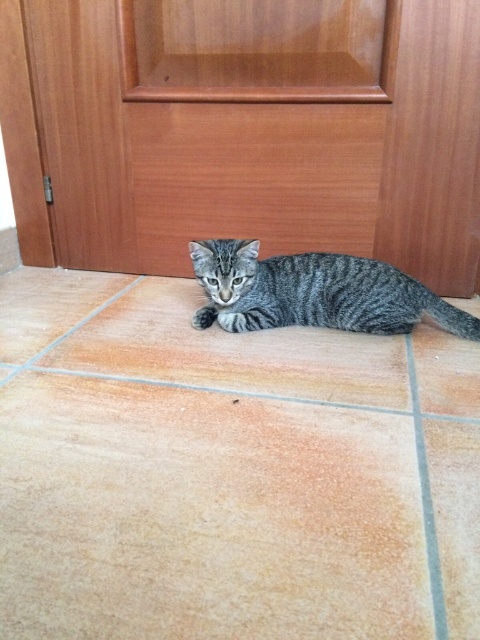
You are a delivery person trying to place a small box on the floor near the wooden door at center and the brown tile at center. Which object should you place the box closer to if you want it to be near the larger object?

The wooden door at center is bigger than the brown tile at center, so you should place the box closer to the wooden door at center.